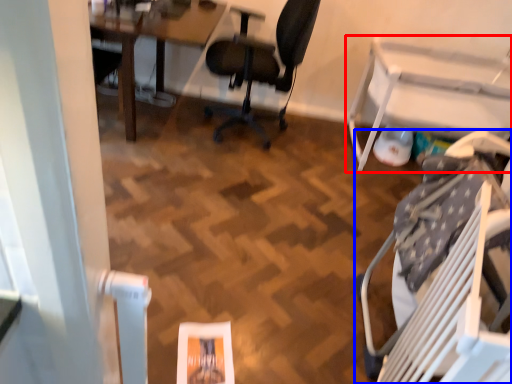
Question: Among these objects, which one is farthest to the camera, table (highlighted by a red box) or chair (highlighted by a blue box)?

Choices:
 (A) table
 (B) chair

Answer: (A)